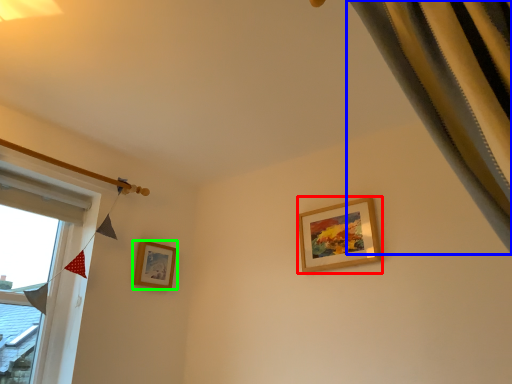
Question: Which object is the farthest from picture frame (highlighted by a red box)? Choose among these: curtain (highlighted by a blue box) or picture frame (highlighted by a green box).

Choices:
 (A) curtain
 (B) picture frame

Answer: (A)